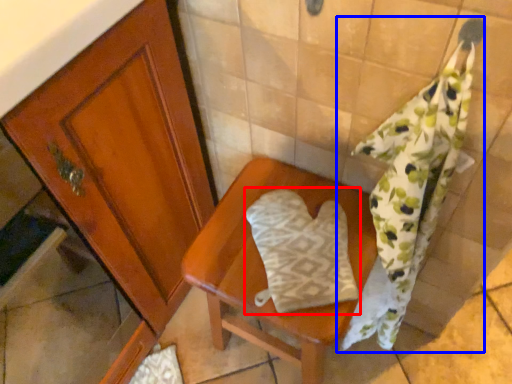
Question: Which object is further to the camera taking this photo, throw pillow (highlighted by a red box) or bath towel (highlighted by a blue box)?

Choices:
 (A) throw pillow
 (B) bath towel

Answer: (A)